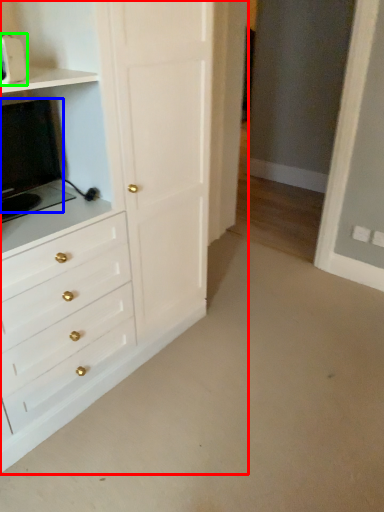
Question: Estimate the real-world distances between objects in this image. Which object is farther from chest of drawers (highlighted by a red box), appliance (highlighted by a blue box) or appliance (highlighted by a green box)?

Choices:
 (A) appliance
 (B) appliance

Answer: (B)